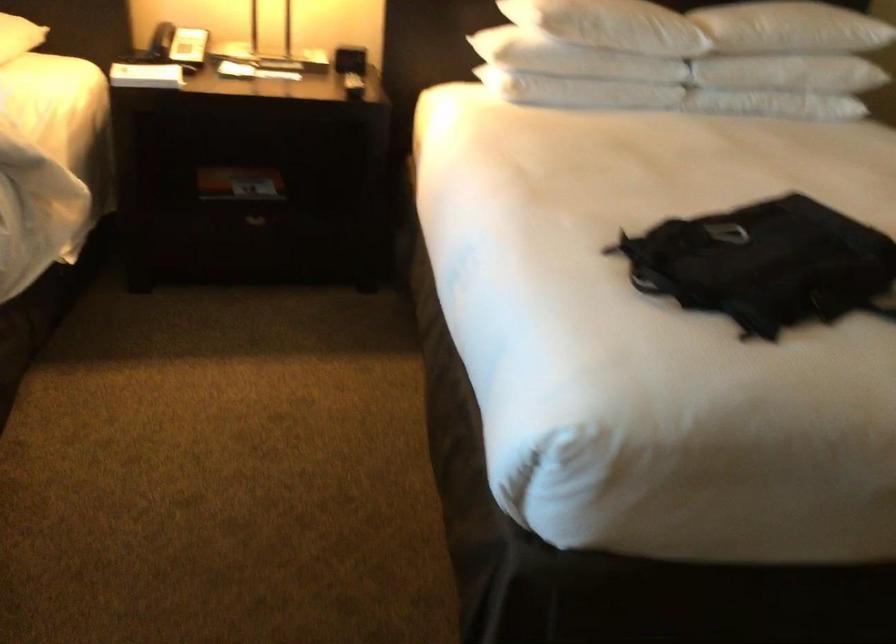
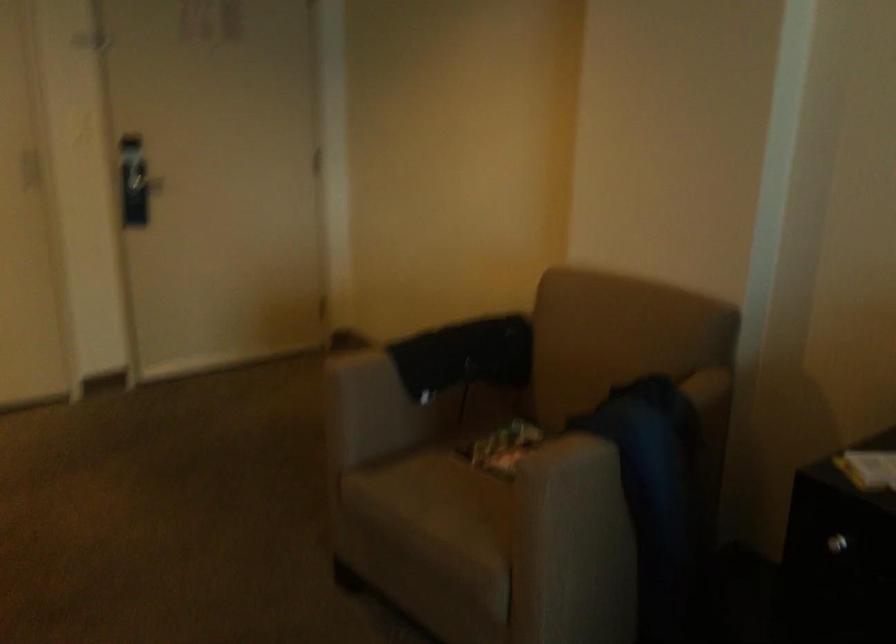
The first image is from the beginning of the video and the second image is from the end. How did the camera likely rotate when shooting the video?

The rotation direction of the camera is right-down.